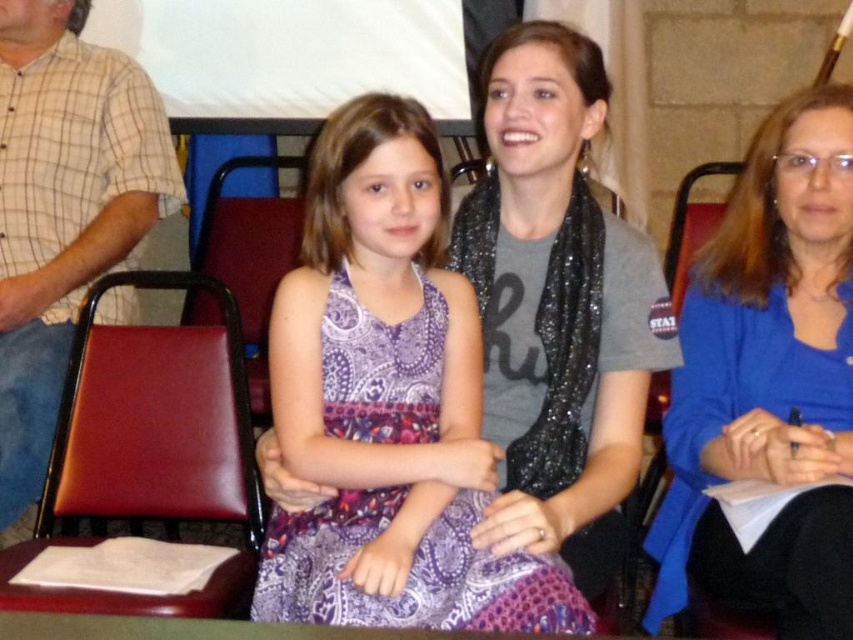
Can you confirm if blue fabric shirt at right is positioned above brown leather chair at center?

Incorrect, blue fabric shirt at right is not positioned above brown leather chair at center.

Does blue fabric shirt at right have a smaller size compared to brown leather chair at center?

Yes.

Between point (675, 588) and point (264, 164), which one is positioned behind?

Point (264, 164)

Where is `blue fabric shirt at right`? blue fabric shirt at right is located at coordinates (769, 381).

Is purple paisley dress at center shorter than blue fabric shirt at right?

Indeed, purple paisley dress at center has a lesser height compared to blue fabric shirt at right.

Can you confirm if purple paisley dress at center is wider than blue fabric shirt at right?

Correct, the width of purple paisley dress at center exceeds that of blue fabric shirt at right.

Is point (396, 538) positioned behind point (793, 260)?

No, (396, 538) is closer to viewer.

Locate an element on the screen. purple paisley dress at center is located at coordinates (387, 403).

How much distance is there between blue fabric shirt at right and leather at left?

blue fabric shirt at right and leather at left are 38.14 inches apart from each other.

Between blue fabric shirt at right and leather at left, which one appears on the left side from the viewer's perspective?

Positioned to the left is leather at left.

The height and width of the screenshot is (640, 853). I want to click on blue fabric shirt at right, so click(769, 381).